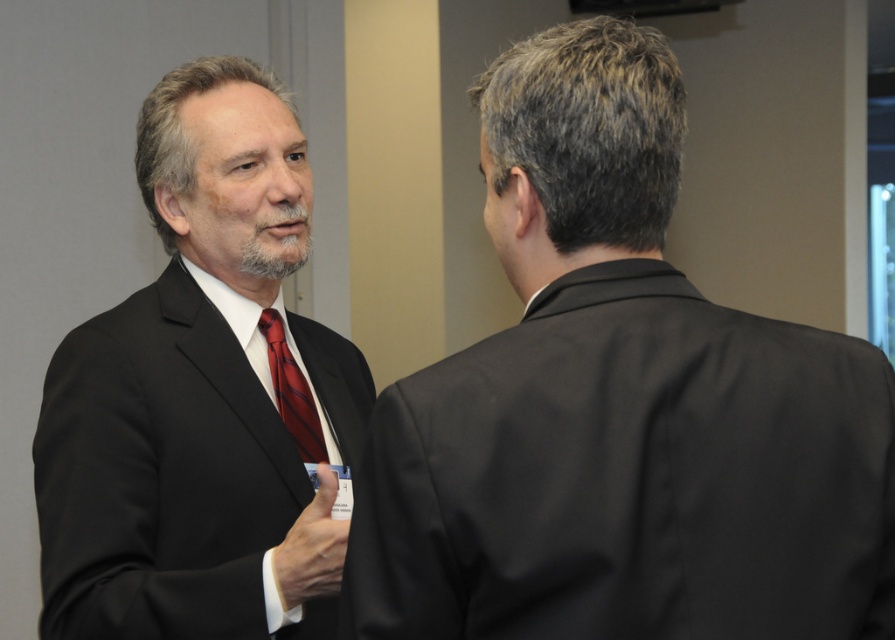
Question: Is matte black suit at center thinner than matte black suit at left?

Choices:
 (A) yes
 (B) no

Answer: (B)

Question: Can you confirm if matte black suit at center is thinner than matte black suit at left?

Choices:
 (A) yes
 (B) no

Answer: (B)

Question: Which point is closer to the camera?

Choices:
 (A) (321, 458)
 (B) (184, 384)

Answer: (B)

Question: Which point is farther to the camera?

Choices:
 (A) matte black suit at center
 (B) shiny silk tie at left
 (C) matte black suit at left

Answer: (B)

Question: In this image, where is matte black suit at center located relative to shiny silk tie at left?

Choices:
 (A) right
 (B) left

Answer: (A)

Question: Among these objects, which one is nearest to the camera?

Choices:
 (A) shiny silk tie at left
 (B) matte black suit at left
 (C) matte black suit at center

Answer: (C)